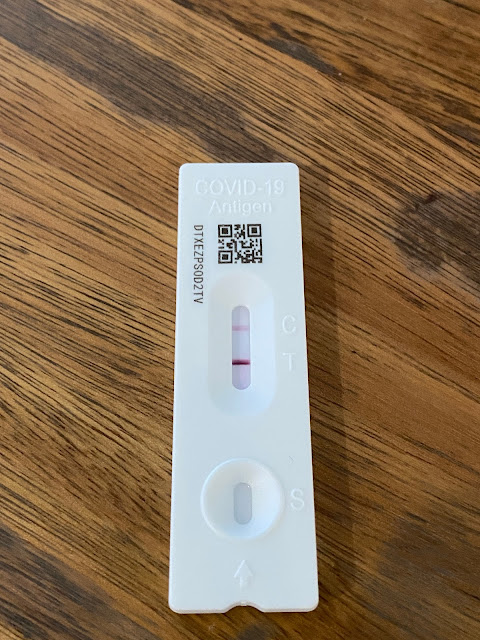
At what (x,y) coordinates should I click in order to perform the action: click on at-home covid test. Please return your answer as a coordinate pair (x, y). Looking at the image, I should click on (241, 211).